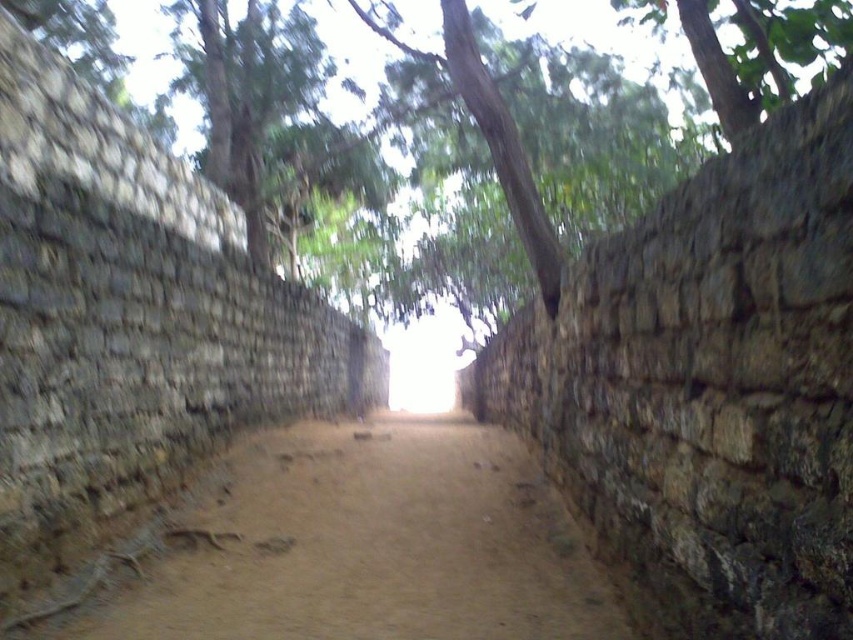
Is brown sandy dirt track at center to the left of green leafy tree at upper center from the viewer's perspective?

Incorrect, brown sandy dirt track at center is not on the left side of green leafy tree at upper center.

Is brown sandy dirt track at center positioned before green leafy tree at upper center?

Answer: Yes, brown sandy dirt track at center is closer to the viewer.

Is point (170, 625) positioned before point (312, 8)?

Yes, point (170, 625) is in front of point (312, 8).

The width and height of the screenshot is (853, 640). In order to click on brown sandy dirt track at center in this screenshot , I will do `click(374, 545)`.